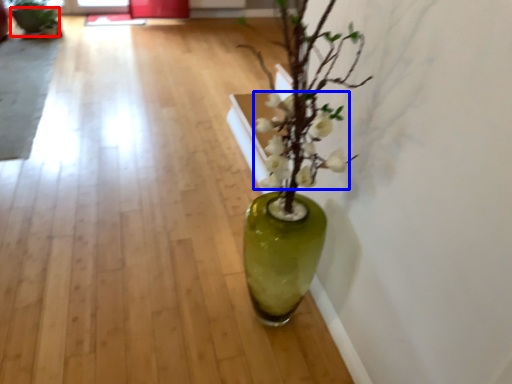
Question: Which point is further to the camera, flowerpot (highlighted by a red box) or flower (highlighted by a blue box)?

Choices:
 (A) flowerpot
 (B) flower

Answer: (A)